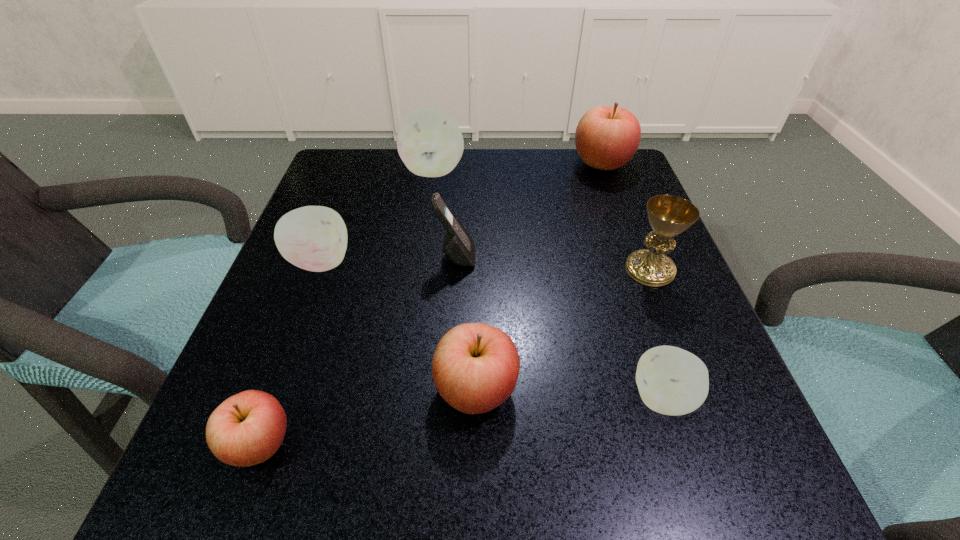
Image resolution: width=960 pixels, height=540 pixels. Identify the location of free space between the chalice and the cellular telephone. (553, 263).

Locate an element on the screen. The height and width of the screenshot is (540, 960). vacant area that lies between the leftmost red apple and the farthest white apple is located at coordinates (347, 307).

Locate an element on the screen. empty space that is in between the farthest red apple and the cellular telephone is located at coordinates (529, 210).

Locate an element on the screen. The image size is (960, 540). free space between the cellular telephone and the smallest white apple is located at coordinates (560, 327).

Locate an element on the screen. The height and width of the screenshot is (540, 960). vacant space in between the second smallest red apple and the fourth nearest apple is located at coordinates (398, 326).

Where is `vacant space in between the second smallest red apple and the rightmost white apple`? The width and height of the screenshot is (960, 540). vacant space in between the second smallest red apple and the rightmost white apple is located at coordinates (569, 394).

The height and width of the screenshot is (540, 960). I want to click on free point between the leftmost red apple and the second farthest white apple, so click(290, 353).

What are the coordinates of `empty space between the rightmost red apple and the second biggest red apple` in the screenshot? It's located at (539, 276).

This screenshot has height=540, width=960. What are the coordinates of `free spot between the cellular telephone and the biggest red apple` in the screenshot? It's located at (529, 210).

Identify which object is the second nearest to the chalice. Please provide its 2D coordinates. Your answer should be formatted as a tuple, i.e. [(x, y)], where the tuple contains the x and y coordinates of a point satisfying the conditions above.

[(606, 138)]